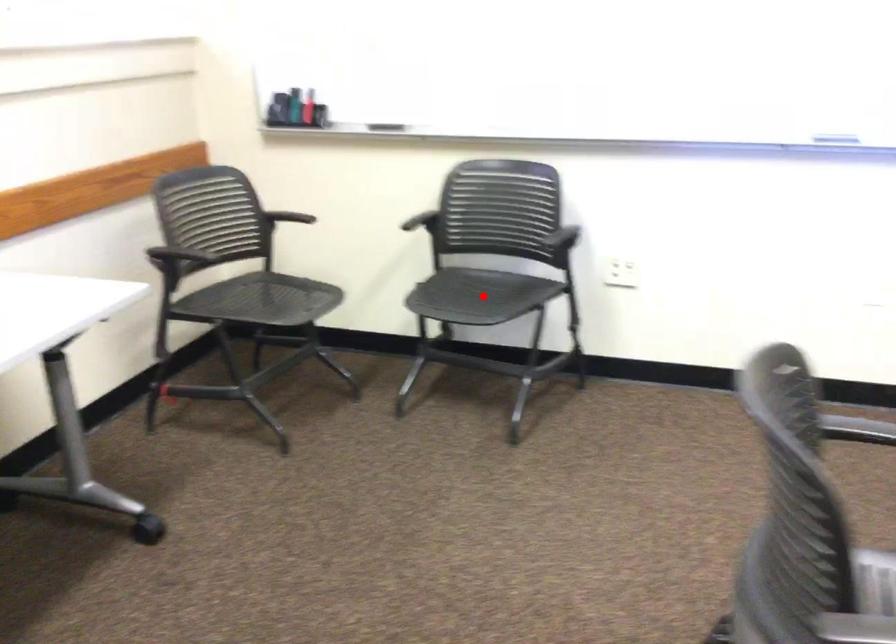
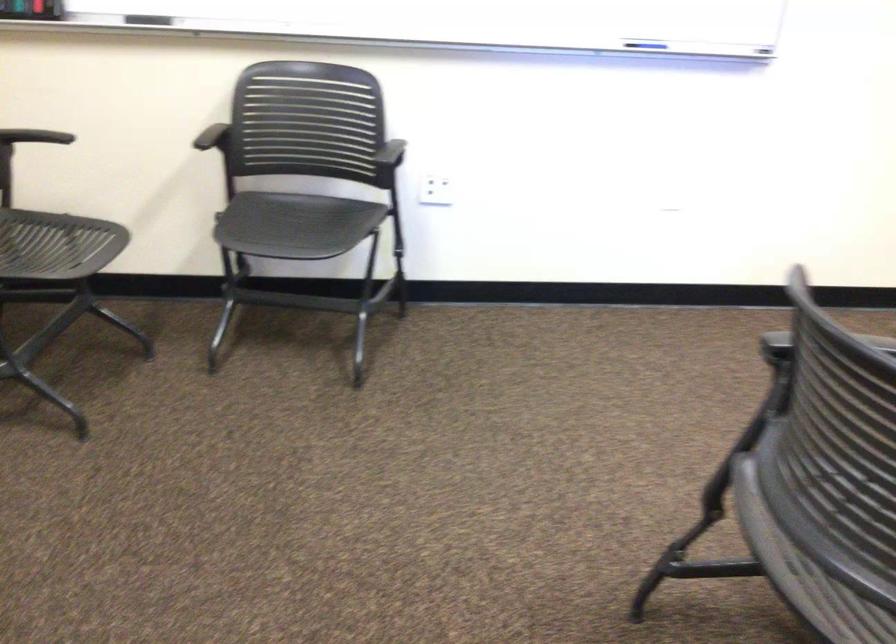
Question: I am providing you with two images of the same scene from different viewpoints. Given a red point in image1, look at the same physical point in image2. Is it:

Choices:
 (A) Closer to the viewpoint
 (B) Farther from the viewpoint

Answer: (A)